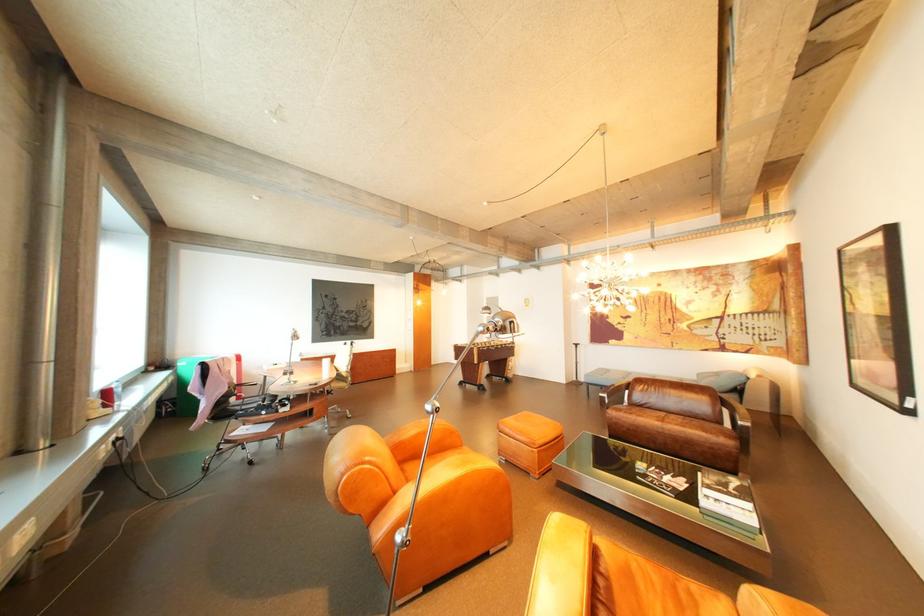
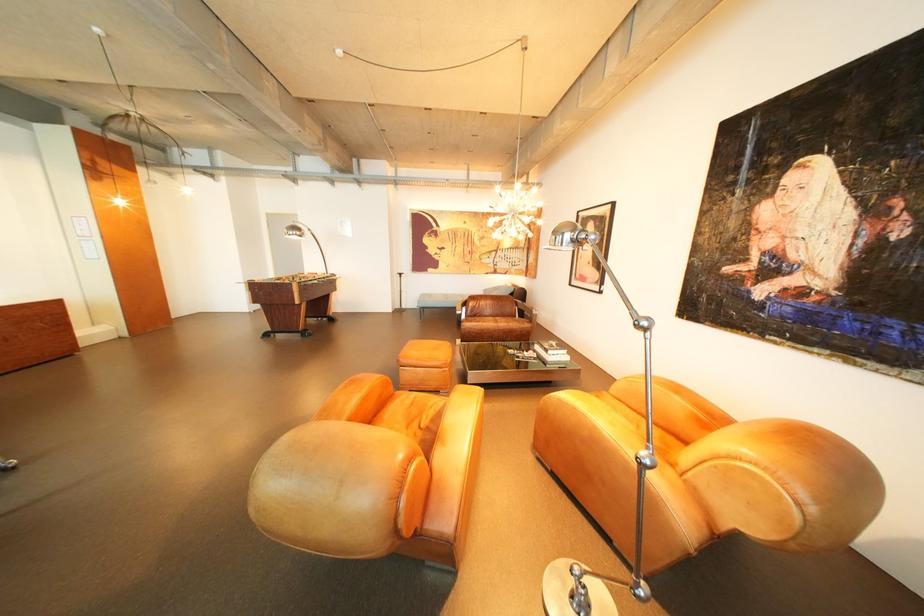
Locate, in the second image, the point that corresponds to the point at 621,371 in the first image.

(444, 296)